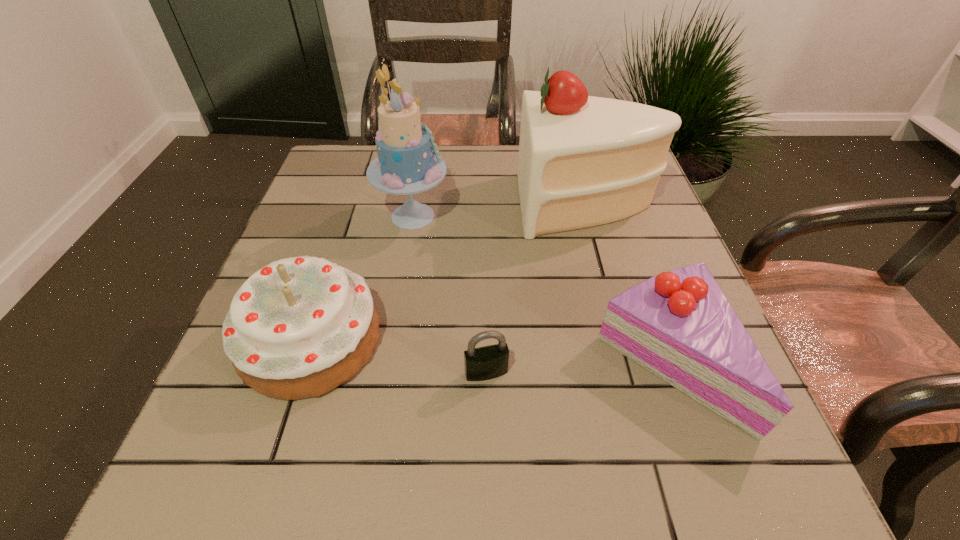
Find the location of a particular element. the second closest cake to the shortest object is located at coordinates (679, 325).

Image resolution: width=960 pixels, height=540 pixels. In order to click on cake identified as the second closest to the second shortest object in this screenshot , I will do `click(408, 163)`.